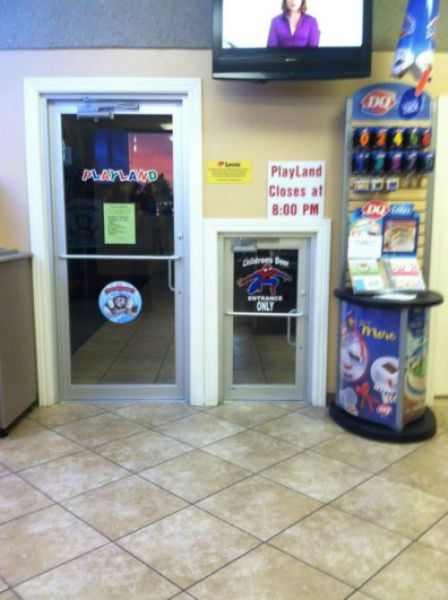
This screenshot has width=448, height=600. I want to click on tv, so coord(288,35).